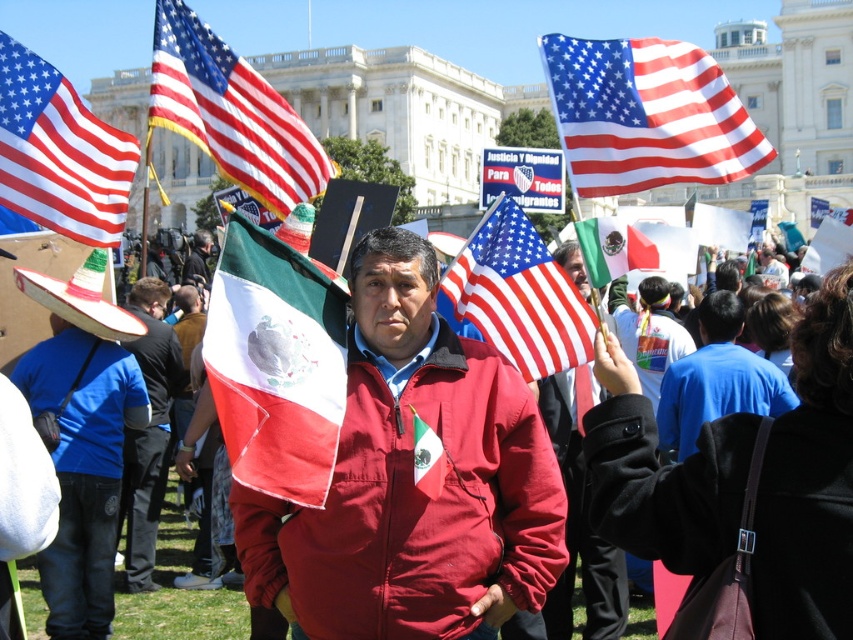
You are a photographer trying to capture the blue cotton shirt at center and the red white and blue fabric at upper right in the same frame. Based on their positions, which object should you adjust your camera to focus on first to ensure both are in the shot?

The red white and blue fabric at upper right is to the left of the blue cotton shirt at center, so you should focus on the red white and blue fabric at upper right first to ensure both are in the frame.

You are a photographer trying to capture the protest scene. You notice two points in the image at coordinates point (782, 454) and point (648, 262). Which of these points is nearer to your camera lens?

Point (782, 454) is closer to the viewer than point (648, 262), so the point at (782, 454) is nearer to your camera lens.